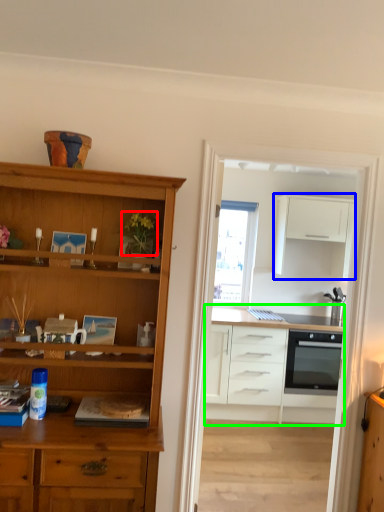
Question: Which is farther away from plant (highlighted by a red box)? cabinetry (highlighted by a blue box) or cabinetry (highlighted by a green box)?

Choices:
 (A) cabinetry
 (B) cabinetry

Answer: (A)